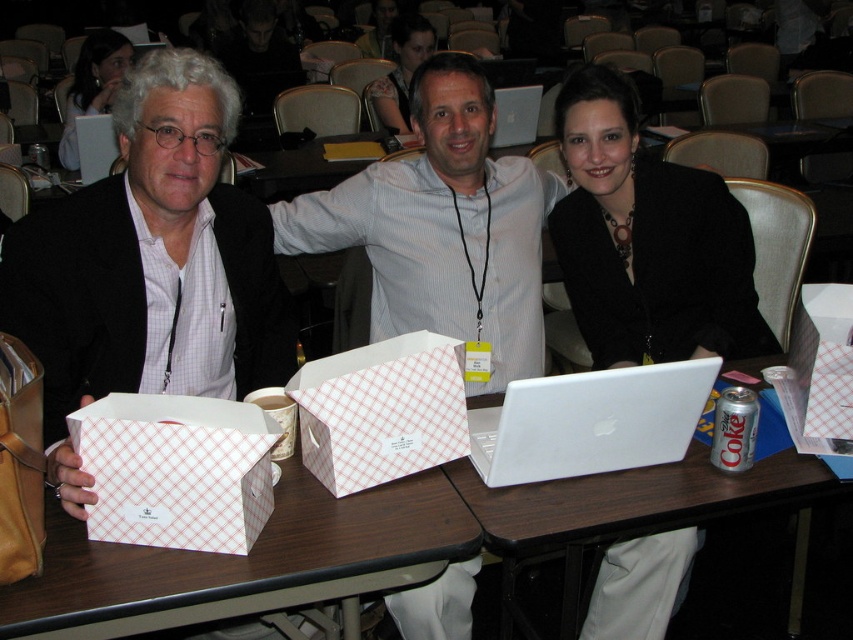
You are a photographer taking a picture of the matte white box at left and the black fabric jacket at center. You want to ensure both objects are in focus. Which object should you adjust your camera focus closer to?

The matte white box at left is thinner than the black fabric jacket at center, so you should focus closer to the matte white box at left since thinner objects require a closer focus to capture details accurately.

You are organizing a gift exchange at a conference and need to place the matte white box at left and the white paper box at lower left on a shelf. According to their positions in the image, which box should be placed to the left of the other?

The matte white box at left should be placed to the left of the white paper box at lower left since it is positioned on the left side of it in the image.

Looking at this image, you are an event planner trying to place a name tag for the person sitting to the left of the matte white box at left. Where should you place the name tag?

The matte white box at left is located at point (149, 266), so the person to its left would be positioned to the left of this coordinate. Place the name tag accordingly.